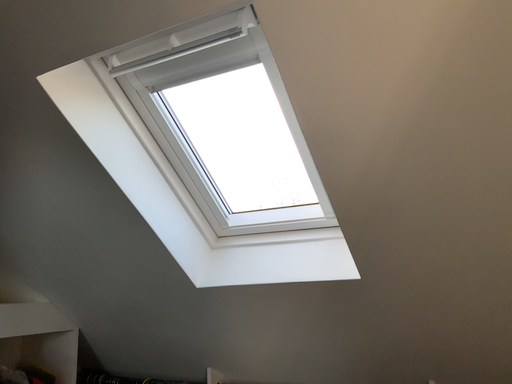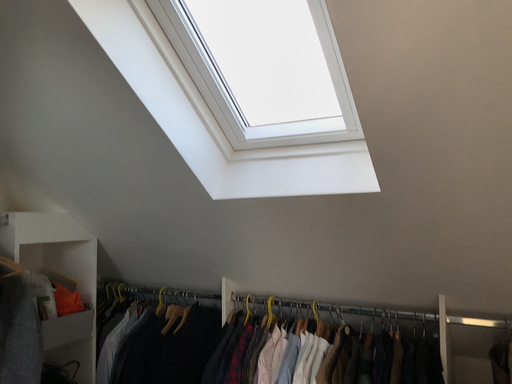
Question: Which way did the camera rotate in the video?

Choices:
 (A) rotated upward
 (B) rotated downward

Answer: (B)